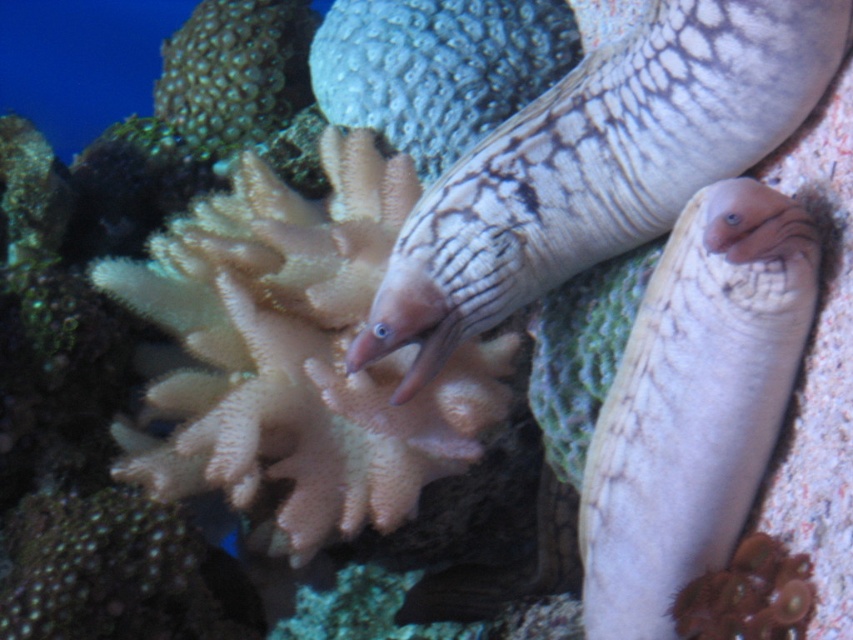
You are a marine biologist observing the underwater scene. You notice the smooth beige eel at right and the green textured coral at upper left. Based on their positions, which object is located lower in the water?

The smooth beige eel at right is located below the green textured coral at upper left, so it is positioned lower in the water.

You are a marine biologist observing the underwater scene. You notice the speckled white eel at center and the textured gray coral at center. Which object is wider?

The speckled white eel at center might be wider than textured gray coral at center according to the description.